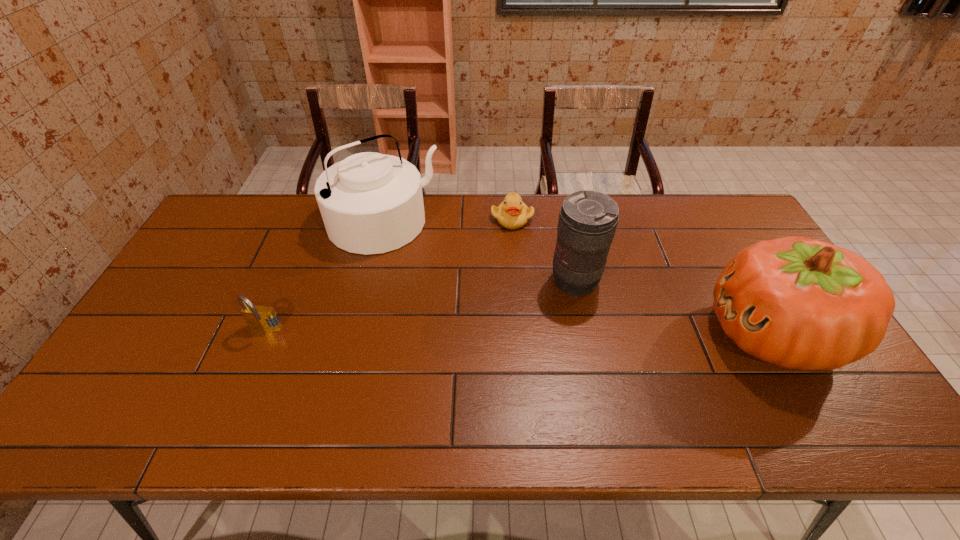
I want to click on vacant space located 0.190m on the side of the rightmost object with the cute face, so click(636, 334).

What are the coordinates of `free region located on the side of the second object from right to left where the control switches are located` in the screenshot? It's located at (452, 361).

I want to click on vacant space located on the side of the second object from right to left where the control switches are located, so click(x=462, y=355).

Identify the location of free point located on the side of the second object from right to left where the control switches are located. The width and height of the screenshot is (960, 540). (541, 303).

At what (x,y) coordinates should I click in order to perform the action: click on free space located 0.400m on the spout of the fourth object from right to left. Please return your answer as a coordinate pair (x, y). Looking at the image, I should click on (480, 334).

Where is `vacant region located 0.050m on the spout of the fourth object from right to left`? The image size is (960, 540). vacant region located 0.050m on the spout of the fourth object from right to left is located at coordinates (417, 259).

You are a GUI agent. You are given a task and a screenshot of the screen. Output one action in this format:
    pyautogui.click(x=<x>, y=<y>)
    Task: Click on the vacant space located 0.100m on the spout of the fourth object from right to left
    This screenshot has height=540, width=960.
    Given the screenshot: What is the action you would take?
    pyautogui.click(x=424, y=268)

Locate an element on the screen. This screenshot has width=960, height=540. vacant area located on the front-facing side of the shortest object is located at coordinates (547, 273).

Where is `vacant space located 0.200m on the front-facing side of the shortest object`? vacant space located 0.200m on the front-facing side of the shortest object is located at coordinates pos(546,271).

Where is `free region located 0.130m on the front-facing side of the shortest object`? Image resolution: width=960 pixels, height=540 pixels. free region located 0.130m on the front-facing side of the shortest object is located at coordinates (537, 255).